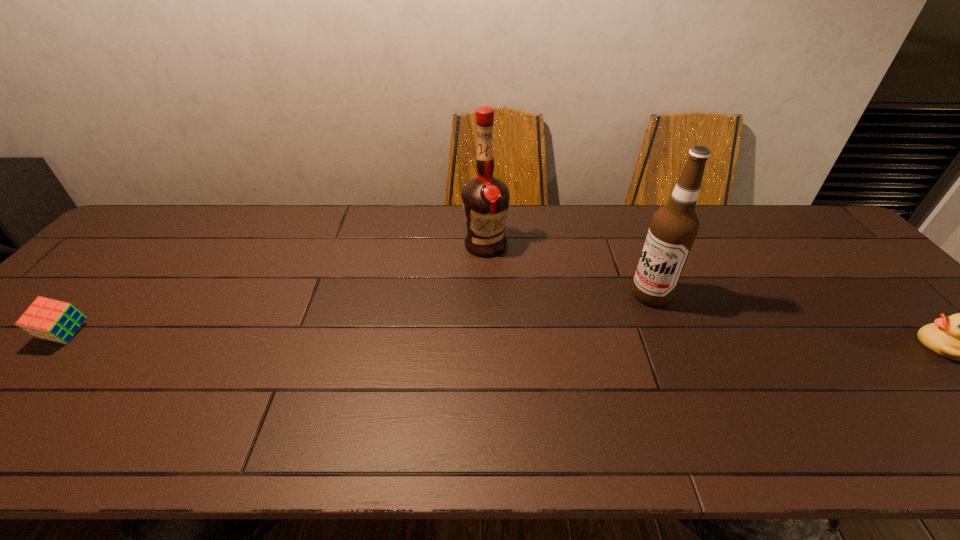
This screenshot has height=540, width=960. In order to click on cube in this screenshot , I will do (53, 320).

Locate an element on the screen. The height and width of the screenshot is (540, 960). alcohol is located at coordinates (673, 229).

Locate an element on the screen. The width and height of the screenshot is (960, 540). the third nearest object is located at coordinates (673, 229).

Locate an element on the screen. The image size is (960, 540). the second object from left to right is located at coordinates (485, 199).

Where is `liquor`? The image size is (960, 540). liquor is located at coordinates point(485,199).

This screenshot has width=960, height=540. In order to click on vacant region located 0.170m on the back of the cube in this screenshot , I will do `click(120, 275)`.

Where is `free space located 0.200m on the label of the alcohol`? free space located 0.200m on the label of the alcohol is located at coordinates (589, 342).

You are a GUI agent. You are given a task and a screenshot of the screen. Output one action in this format:
    pyautogui.click(x=<x>, y=<y>)
    Task: Click on the vacant region located on the label of the alcohol
    Image resolution: width=960 pixels, height=540 pixels.
    Given the screenshot: What is the action you would take?
    pyautogui.click(x=564, y=362)

Image resolution: width=960 pixels, height=540 pixels. Find the location of `free space located on the label of the alcohol`. free space located on the label of the alcohol is located at coordinates (558, 367).

This screenshot has width=960, height=540. In order to click on vacant space situated 0.220m on the front and back of the farthest object in this screenshot , I will do `click(474, 314)`.